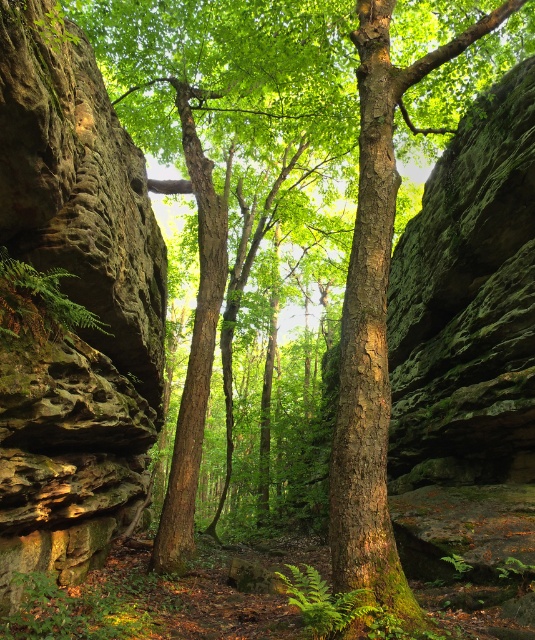
You are an explorer carrying a 5 meter long rope. You want to measure the distance between yourself and the rough textured rock at left. Can you use the rope to reach the rock?

The distance between the rough textured rock at left and the viewer is 4.82 meters. Since the rope is 5 meters long, it is long enough to reach the rock, so yes, you can use the rope to measure the distance.

You are a hiker navigating through the narrow passage between the two large rock walls. You notice the rough textured rock at left and the green mossy fern at left. Which object is closer to you as you face the passage?

The rough textured rock at left is closer to you because the green mossy fern at left is positioned behind it.

You are a hiker trying to navigate through the narrow passage between the two large rock walls. You notice the rough textured rock at left and the green mossy fern at left. Which of these two objects takes up more space in the scene?

The green mossy fern at left occupies more space than the rough textured rock at left according to the description.